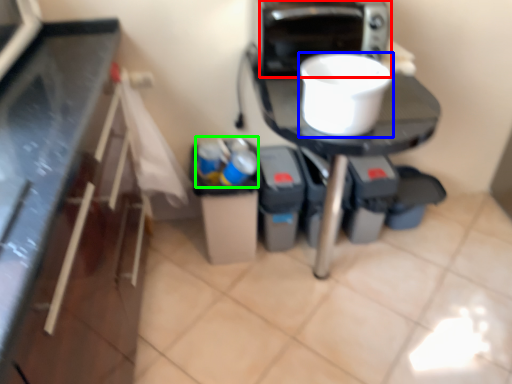
Question: Which is farther away from home appliance (highlighted by a red box)? kitchen appliance (highlighted by a blue box) or garbage (highlighted by a green box)?

Choices:
 (A) kitchen appliance
 (B) garbage

Answer: (B)